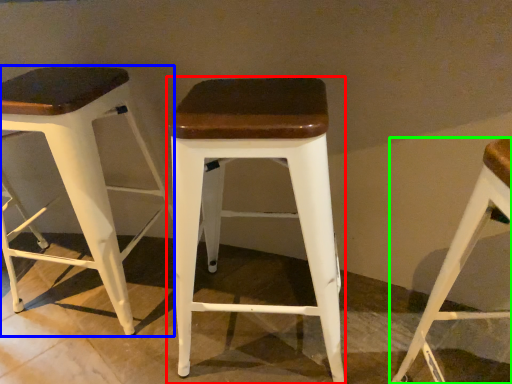
Question: Estimate the real-world distances between objects in this image. Which object is farther from stool (highlighted by a red box), stool (highlighted by a blue box) or stool (highlighted by a green box)?

Choices:
 (A) stool
 (B) stool

Answer: (A)